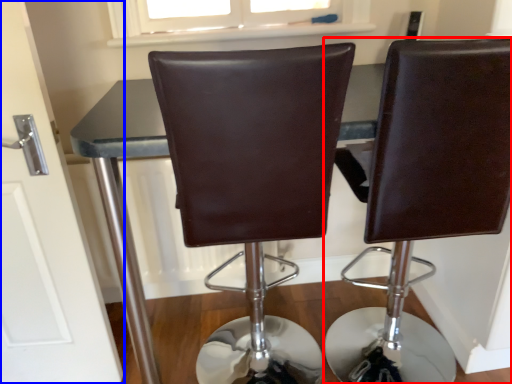
Question: Which object appears closest to the camera in this image, chair (highlighted by a red box) or door (highlighted by a blue box)?

Choices:
 (A) chair
 (B) door

Answer: (A)